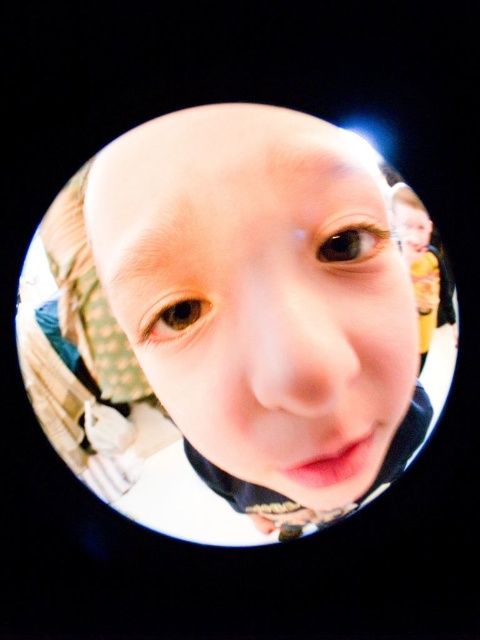
Based on the scene description, if you were to compare the sizes of the smooth skin face at center and the smooth yellow shirt at right, which one appears taller?

The smooth skin face at center is taller than the smooth yellow shirt at right.

You are a photographer holding a camera with a fisheye lens. You want to take a closeup portrait of someone wearing a patterned headscarf. You notice a point at coordinate point (151, 177) that you want to focus on. If the point is 19.47 inches away from you, is it within the recommended focusing range of 18 to 24 inches for portraits?

The point at (151, 177) is 19.47 inches away from the viewer, which falls within the recommended focusing range of 18 to 24 inches for portraits. Therefore, it is within range.